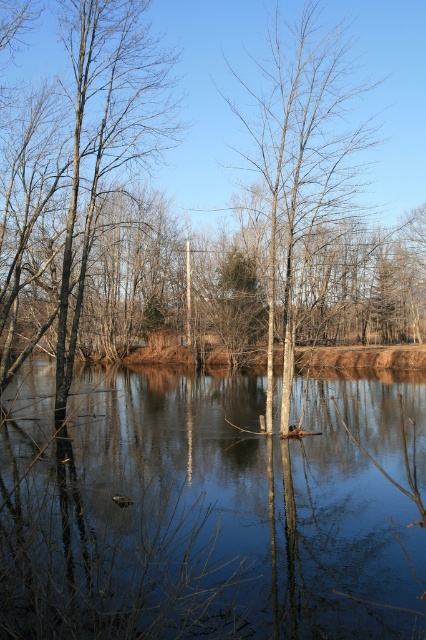
Question: Which point is closer to the camera taking this photo?

Choices:
 (A) (74, 60)
 (B) (241, 468)

Answer: (B)

Question: Estimate the real-world distances between objects in this image. Which object is closer to the brown bark tree at left?

Choices:
 (A) transparent water at center
 (B) bare wood tree at center

Answer: (A)

Question: From the image, what is the correct spatial relationship of transparent water at center in relation to brown bark tree at left?

Choices:
 (A) below
 (B) above

Answer: (A)

Question: Is brown bark tree at left thinner than bare wood tree at center?

Choices:
 (A) yes
 (B) no

Answer: (B)

Question: Is transparent water at center further to camera compared to bare wood tree at center?

Choices:
 (A) yes
 (B) no

Answer: (B)

Question: Which point is closer to the camera?

Choices:
 (A) brown bark tree at left
 (B) bare wood tree at center

Answer: (B)